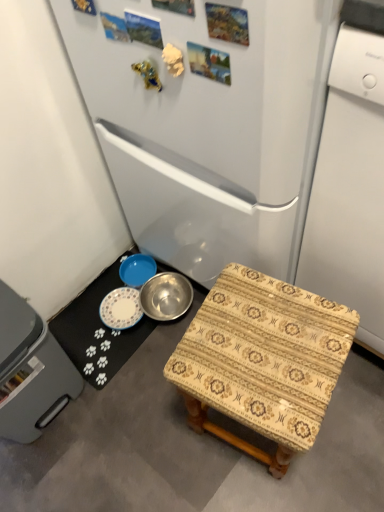
Question: Is metallic silver bowl at lower center oriented away from gray plastic dishwasher at lower left?

Choices:
 (A) yes
 (B) no

Answer: (B)

Question: From a real-world perspective, is metallic silver bowl at lower center positioned over gray plastic dishwasher at lower left based on gravity?

Choices:
 (A) no
 (B) yes

Answer: (A)

Question: Is metallic silver bowl at lower center thinner than gray plastic dishwasher at lower left?

Choices:
 (A) yes
 (B) no

Answer: (B)

Question: From a real-world perspective, is metallic silver bowl at lower center located beneath gray plastic dishwasher at lower left?

Choices:
 (A) yes
 (B) no

Answer: (A)

Question: Is metallic silver bowl at lower center to the left of gray plastic dishwasher at lower left from the viewer's perspective?

Choices:
 (A) no
 (B) yes

Answer: (A)

Question: From the image's perspective, is patterned fabric stool at lower right above or below gray plastic dishwasher at lower left?

Choices:
 (A) above
 (B) below

Answer: (B)

Question: Would you say patterned fabric stool at lower right is to the left or to the right of gray plastic dishwasher at lower left in the picture?

Choices:
 (A) left
 (B) right

Answer: (B)

Question: In the image, is patterned fabric stool at lower right positioned in front of or behind gray plastic dishwasher at lower left?

Choices:
 (A) front
 (B) behind

Answer: (A)

Question: Considering the positions of patterned fabric stool at lower right and gray plastic dishwasher at lower left in the image, is patterned fabric stool at lower right wider or thinner than gray plastic dishwasher at lower left?

Choices:
 (A) thin
 (B) wide

Answer: (B)

Question: Visually, is white glossy dishwasher at right positioned to the left or to the right of white glossy refrigerator at center?

Choices:
 (A) left
 (B) right

Answer: (B)

Question: Does point (360, 68) appear closer or farther from the camera than point (56, 17)?

Choices:
 (A) farther
 (B) closer

Answer: (B)

Question: Is white glossy dishwasher at right in front of or behind white glossy refrigerator at center in the image?

Choices:
 (A) behind
 (B) front

Answer: (B)

Question: Do you think white glossy dishwasher at right is within white glossy refrigerator at center, or outside of it?

Choices:
 (A) inside
 (B) outside

Answer: (B)

Question: In terms of width, does metallic silver bowl at lower center look wider or thinner when compared to patterned fabric stool at lower right?

Choices:
 (A) wide
 (B) thin

Answer: (B)

Question: From the image's perspective, is metallic silver bowl at lower center located above or below patterned fabric stool at lower right?

Choices:
 (A) below
 (B) above

Answer: (B)